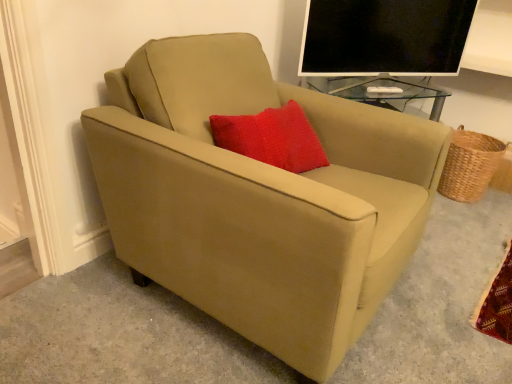
Question: Is black glossy monitor at upper right taller than suede beige armchair at center?

Choices:
 (A) yes
 (B) no

Answer: (B)

Question: Is black glossy monitor at upper right bigger than suede beige armchair at center?

Choices:
 (A) yes
 (B) no

Answer: (B)

Question: From the image's perspective, is black glossy monitor at upper right beneath suede beige armchair at center?

Choices:
 (A) no
 (B) yes

Answer: (A)

Question: Is black glossy monitor at upper right looking in the opposite direction of suede beige armchair at center?

Choices:
 (A) no
 (B) yes

Answer: (A)

Question: Considering the relative positions of black glossy monitor at upper right and suede beige armchair at center in the image provided, is black glossy monitor at upper right in front of suede beige armchair at center?

Choices:
 (A) yes
 (B) no

Answer: (B)

Question: From the image's perspective, is black glossy monitor at upper right above suede beige armchair at center?

Choices:
 (A) no
 (B) yes

Answer: (B)

Question: Is black glossy monitor at upper right taller than woven brown basket at right?

Choices:
 (A) yes
 (B) no

Answer: (A)

Question: Is black glossy monitor at upper right shorter than woven brown basket at right?

Choices:
 (A) no
 (B) yes

Answer: (A)

Question: Considering the relative sizes of black glossy monitor at upper right and woven brown basket at right in the image provided, is black glossy monitor at upper right wider than woven brown basket at right?

Choices:
 (A) yes
 (B) no

Answer: (B)

Question: Does black glossy monitor at upper right appear on the left side of woven brown basket at right?

Choices:
 (A) no
 (B) yes

Answer: (B)

Question: Does black glossy monitor at upper right have a larger size compared to woven brown basket at right?

Choices:
 (A) no
 (B) yes

Answer: (B)

Question: Considering the relative sizes of black glossy monitor at upper right and woven brown basket at right in the image provided, is black glossy monitor at upper right thinner than woven brown basket at right?

Choices:
 (A) no
 (B) yes

Answer: (B)

Question: Is suede beige armchair at center completely or partially outside of black glossy monitor at upper right?

Choices:
 (A) yes
 (B) no

Answer: (A)